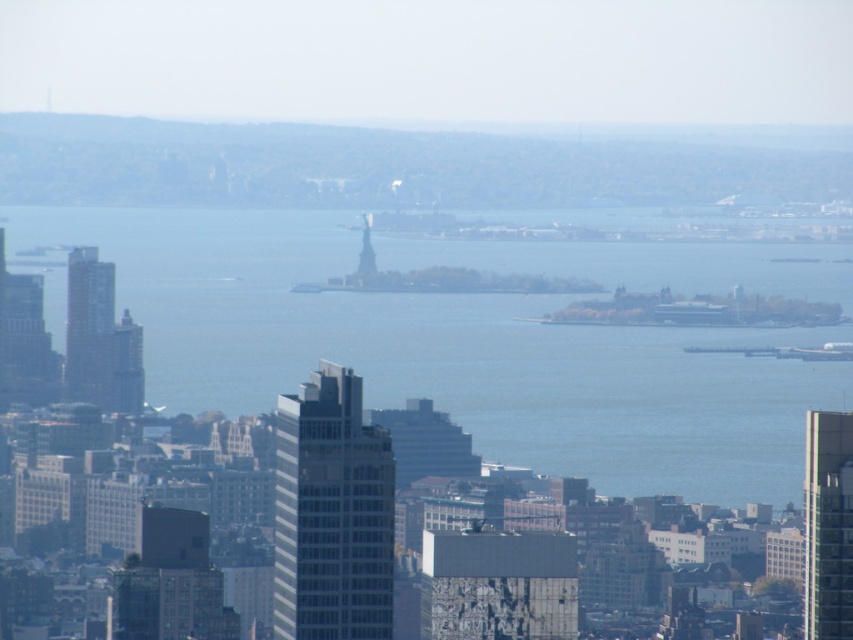
Does white glass building at center lie in front of gray glass skyscraper at left?

Yes, white glass building at center is closer to the viewer.

You are a GUI agent. You are given a task and a screenshot of the screen. Output one action in this format:
    pyautogui.click(x=<x>, y=<y>)
    Task: Click on the white glass building at center
    The width and height of the screenshot is (853, 640).
    Given the screenshot: What is the action you would take?
    pyautogui.click(x=331, y=513)

The image size is (853, 640). What do you see at coordinates (828, 525) in the screenshot?
I see `glassy gray skyscraper at right` at bounding box center [828, 525].

Who is more forward, (830, 429) or (80, 314)?

Point (80, 314) is in front.

The height and width of the screenshot is (640, 853). What are the coordinates of `glassy gray skyscraper at right` in the screenshot? It's located at (828, 525).

Between blue water at center and white glass building at center, which one appears on the left side from the viewer's perspective?

white glass building at center is more to the left.

Who is lower down, blue water at center or white glass building at center?

Positioned lower is white glass building at center.

What do you see at coordinates (450, 353) in the screenshot? I see `blue water at center` at bounding box center [450, 353].

The height and width of the screenshot is (640, 853). I want to click on blue water at center, so click(x=450, y=353).